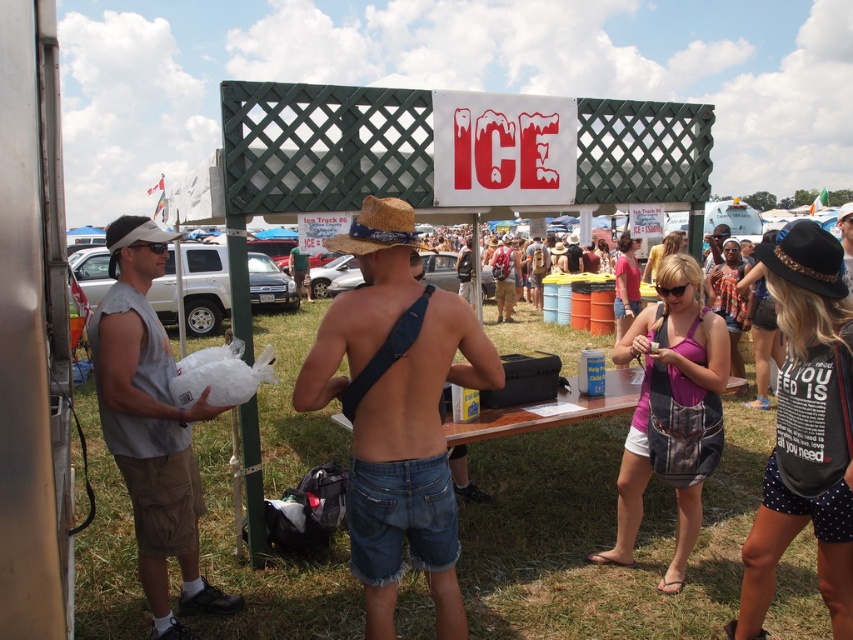
You are organizing a clothing display and need to place the denim shorts at center and the gray fabric shirt at left on a rack. Given their sizes, which item should you place on the wider hanger to ensure they fit properly?

The denim shorts at center has a larger width than the gray fabric shirt at left, so the denim shorts at center should be placed on the wider hanger to ensure they fit properly.

You are at the fair and want to know which of the two points, point 1 at coordinates point (125,316) or point 2 at coordinates point (410,236), is closer to you. Can you determine this based on their positions?

Point 1 at coordinates point (125,316) is closer to you than point 2 at coordinates point (410,236) because it is further to the viewer according to the description.